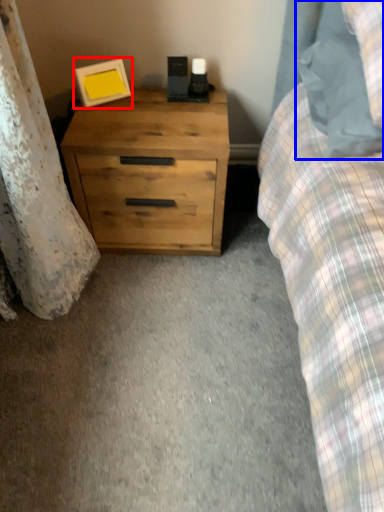
Question: Which object appears closest to the camera in this image, picture frame (highlighted by a red box) or pillow (highlighted by a blue box)?

Choices:
 (A) picture frame
 (B) pillow

Answer: (B)